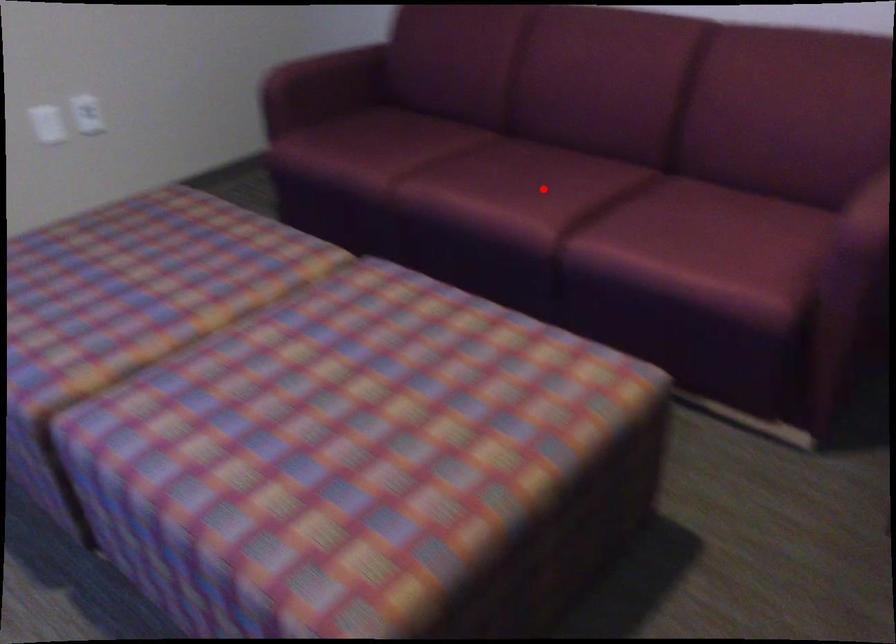
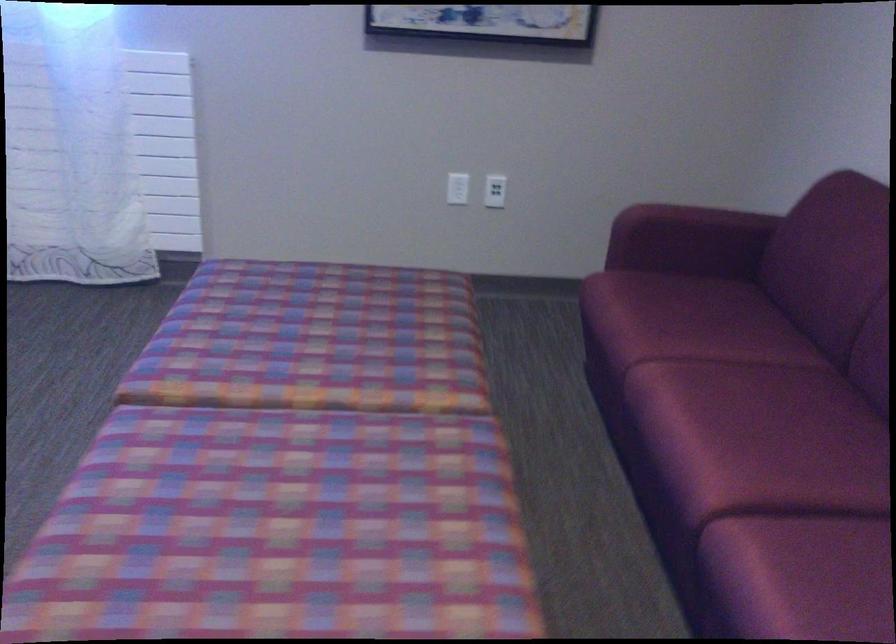
The point at the highlighted location is marked in the first image. Where is the corresponding point in the second image?

(764, 456)